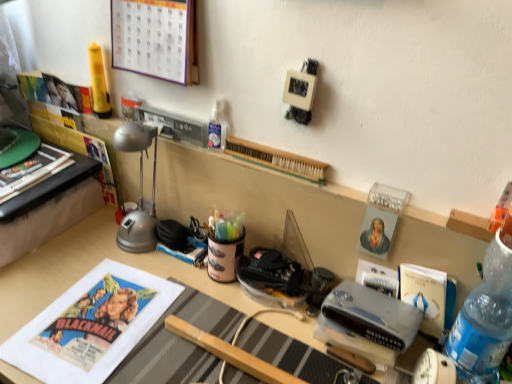
Question: Is wooden toothbrush at center oriented towards matte paper calendar at upper left?

Choices:
 (A) yes
 (B) no

Answer: (B)

Question: Is wooden toothbrush at center wider than matte paper calendar at upper left?

Choices:
 (A) no
 (B) yes

Answer: (A)

Question: Is wooden toothbrush at center positioned in front of matte paper calendar at upper left?

Choices:
 (A) no
 (B) yes

Answer: (A)

Question: Does wooden toothbrush at center appear on the right side of matte paper calendar at upper left?

Choices:
 (A) no
 (B) yes

Answer: (B)

Question: Is wooden toothbrush at center surrounding matte paper calendar at upper left?

Choices:
 (A) yes
 (B) no

Answer: (B)

Question: From a real-world perspective, is wooden toothbrush at center physically located above or below wooden desk at center?

Choices:
 (A) above
 (B) below

Answer: (A)

Question: Based on their sizes in the image, would you say wooden toothbrush at center is bigger or smaller than wooden desk at center?

Choices:
 (A) small
 (B) big

Answer: (A)

Question: Looking at their shapes, would you say wooden toothbrush at center is wider or thinner than wooden desk at center?

Choices:
 (A) thin
 (B) wide

Answer: (A)

Question: From the image's perspective, relative to wooden desk at center, is wooden toothbrush at center above or below?

Choices:
 (A) below
 (B) above

Answer: (B)

Question: From a real-world perspective, is matte paper calendar at upper left above or below blue matte paperback book at center-right, which is the 1th paperback book from right to left?

Choices:
 (A) below
 (B) above

Answer: (B)

Question: In terms of size, does matte paper calendar at upper left appear bigger or smaller than blue matte paperback book at center-right, which is the 1th paperback book from right to left?

Choices:
 (A) big
 (B) small

Answer: (A)

Question: From the image's perspective, is matte paper calendar at upper left above or below blue matte paperback book at center-right, the second paperback book positioned from the left?

Choices:
 (A) above
 (B) below

Answer: (A)

Question: Considering the positions of matte paper calendar at upper left and blue matte paperback book at center-right, the second paperback book positioned from the left, in the image, is matte paper calendar at upper left wider or thinner than blue matte paperback book at center-right, the second paperback book positioned from the left,?

Choices:
 (A) wide
 (B) thin

Answer: (A)

Question: From the image's perspective, is blue plastic bottle at right above or below hardcover book at center, positioned as the second paperback book in right-to-left order?

Choices:
 (A) above
 (B) below

Answer: (B)

Question: Does point (484, 327) appear closer or farther from the camera than point (378, 284)?

Choices:
 (A) closer
 (B) farther

Answer: (A)